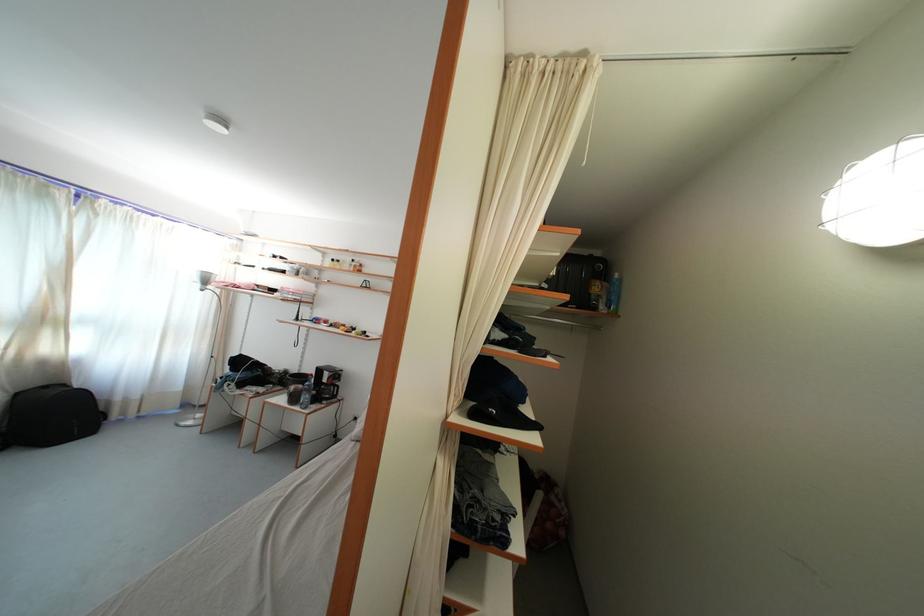
Where would you lift the black wheeled suitcase? Please return your answer as a coordinate pair (x, y).

(51, 416)